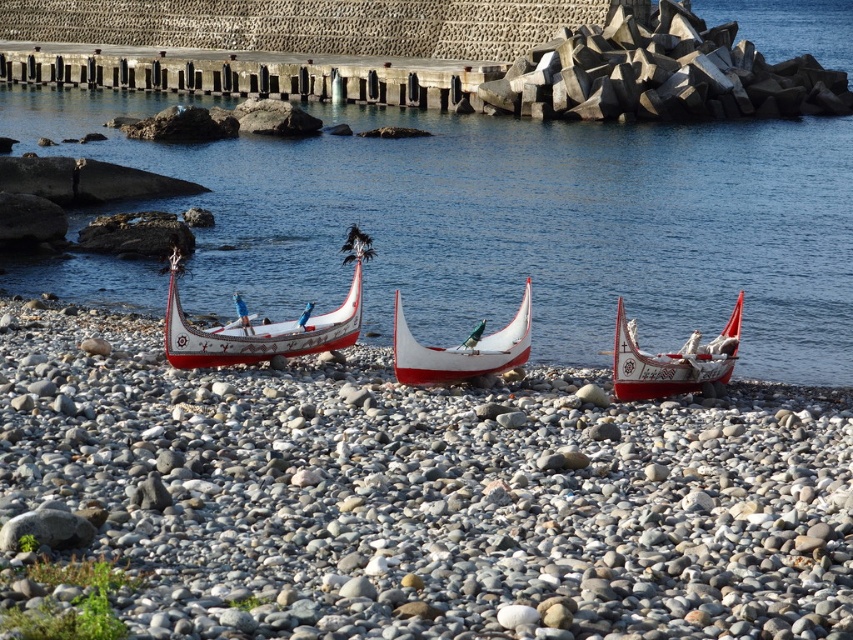
In order to click on transparent water at center in this screenshot , I will do `click(515, 224)`.

Looking at this image, which is more to the left, transparent water at center or white glossy canoe at center?

Positioned to the left is transparent water at center.

Is point (498, 273) farther from camera compared to point (518, 342)?

Yes, it is behind point (518, 342).

The image size is (853, 640). In order to click on transparent water at center in this screenshot , I will do `click(515, 224)`.

The width and height of the screenshot is (853, 640). What do you see at coordinates (515, 224) in the screenshot? I see `transparent water at center` at bounding box center [515, 224].

Does transparent water at center have a lesser width compared to white painted wood boat at center?

Incorrect, transparent water at center's width is not less than white painted wood boat at center's.

Is point (654, 337) less distant than point (248, 353)?

That is False.

This screenshot has height=640, width=853. I want to click on transparent water at center, so click(515, 224).

Is transparent water at center to the left of white glossy boat at center from the viewer's perspective?

Indeed, transparent water at center is positioned on the left side of white glossy boat at center.

Is point (259, 216) more distant than point (689, 364)?

That is True.

The width and height of the screenshot is (853, 640). What are the coordinates of `transparent water at center` in the screenshot? It's located at (515, 224).